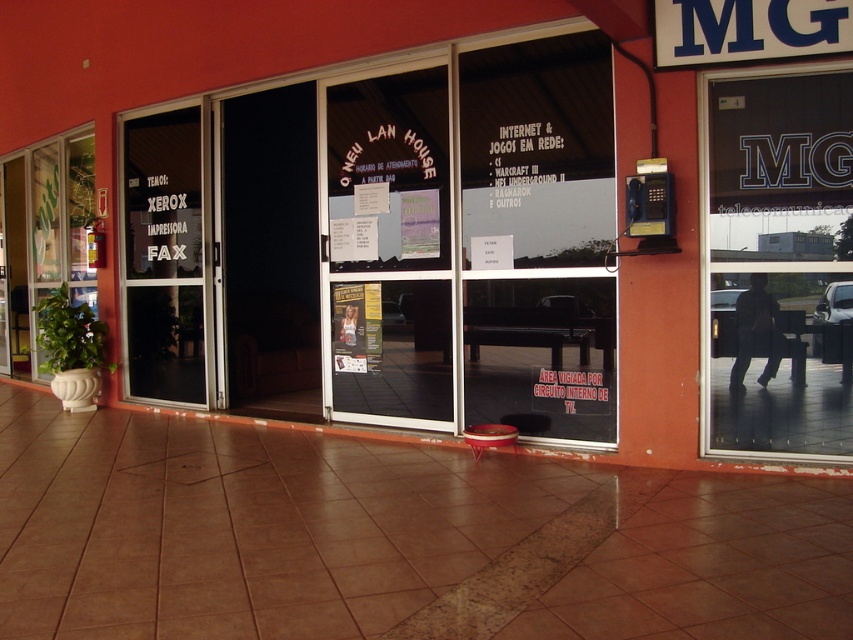
You are a delivery person with a cart that is 2 meters wide. You need to deliver a package to the LAN HOUSE. Can your cart fit through the space between the transparent glass door at upper right and the transparent glass door at center?

The space between the transparent glass door at upper right and the transparent glass door at center is 4.81 meters. Since your cart is 2 meters wide, it can easily fit through the space between the transparent glass door at upper right and the transparent glass door at center.

You are a delivery person approaching the new lan house. You need to determine which object is taller between the transparent glass door at upper right and the green leafy plant at left. Based on the scene, which one is taller?

The green leafy plant at left is taller than the transparent glass door at upper right.